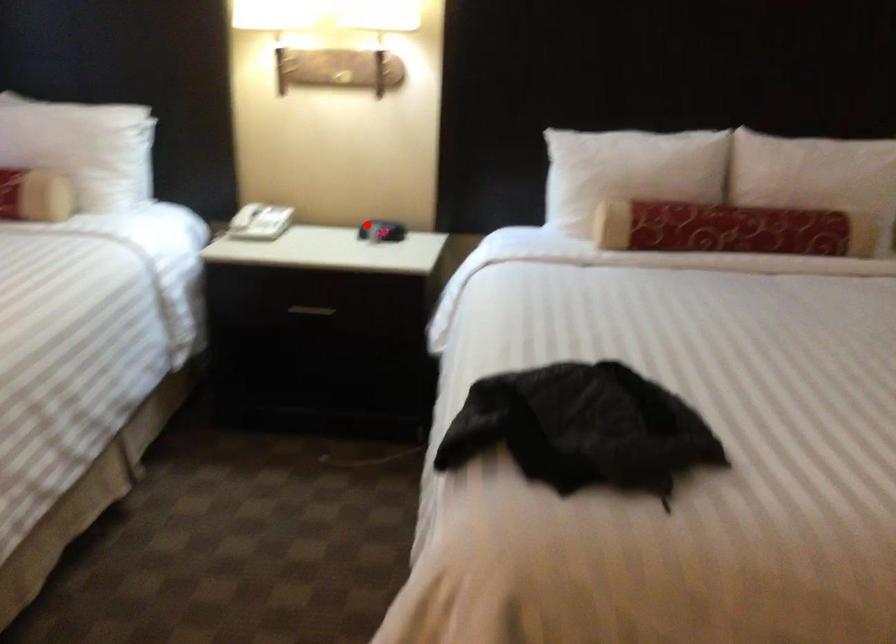
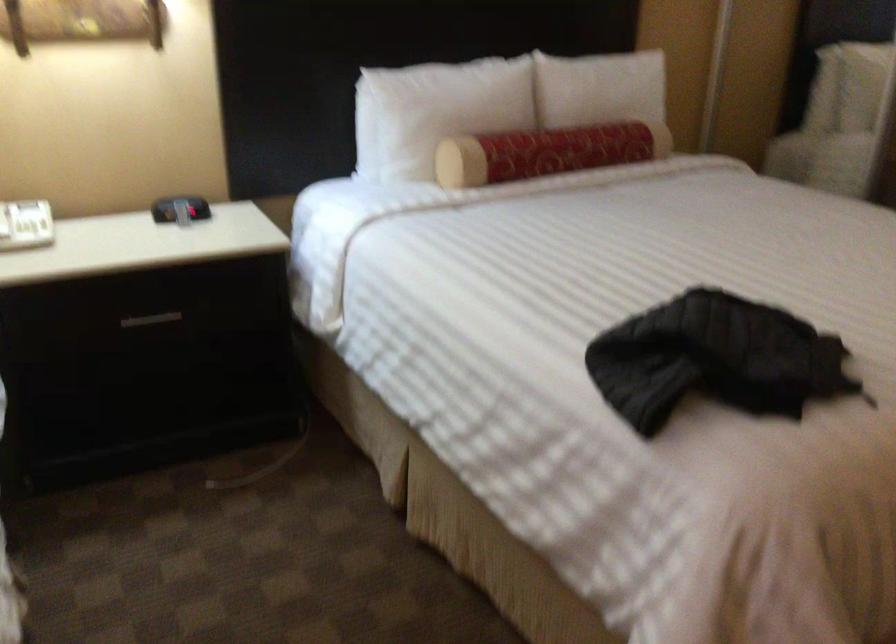
Question: I am providing you with two images of the same scene from different viewpoints. A red point is shown in image1. For the corresponding object point in image2, is it positioned nearer or farther from the camera?

Choices:
 (A) Nearer
 (B) Farther

Answer: (A)